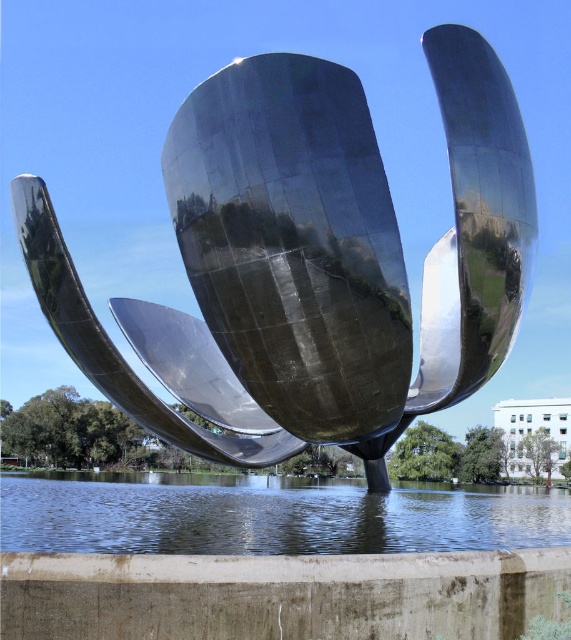
Does point (272, 369) come closer to viewer compared to point (135, 492)?

Yes, point (272, 369) is in front of point (135, 492).

Is point (264, 145) more distant than point (223, 477)?

No, (264, 145) is closer to viewer.

Locate an element on the screen. polished metal flower at center is located at coordinates (309, 262).